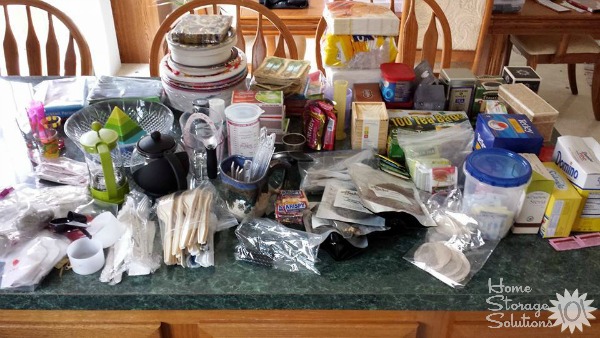
What are the coordinates of `kitchen` in the screenshot? It's located at (412, 327).